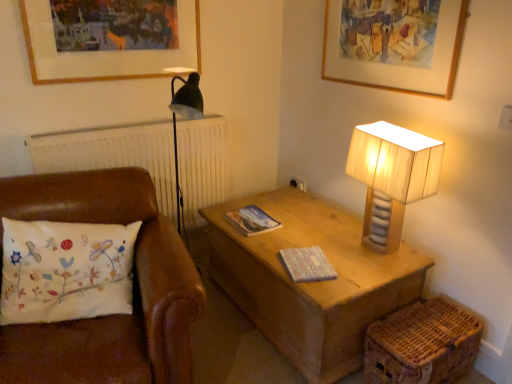
Question: Considering their positions, is matte paper magazine at center, which is the first magazine from back to front, located in front of or behind wooden lampshade at right?

Choices:
 (A) front
 (B) behind

Answer: (B)

Question: Is matte paper magazine at center, which is the first magazine from back to front, bigger or smaller than wooden lampshade at right?

Choices:
 (A) small
 (B) big

Answer: (A)

Question: Which object is positioned closest to the matte paper magazine at center, arranged as the 1th magazine when viewed from the top?

Choices:
 (A) white embroidered pillow at left
 (B) wooden picture frame at upper left, which appears as the second picture frame when viewed from the right
 (C) woven brown basket at lower right
 (D) wooden textured book at center, arranged as the 2th magazine when viewed from the left
 (E) wooden lampshade at right

Answer: (D)

Question: Considering the real-world distances, which object is closest to the wooden textured book at center, which is counted as the 2th magazine, starting from the back?

Choices:
 (A) wooden lampshade at right
 (B) white embroidered pillow at left
 (C) matte paper magazine at center, the 2th magazine in the right-to-left sequence
 (D) woven brown basket at lower right
 (E) wooden picture frame at upper center, the second picture frame positioned from the left

Answer: (C)